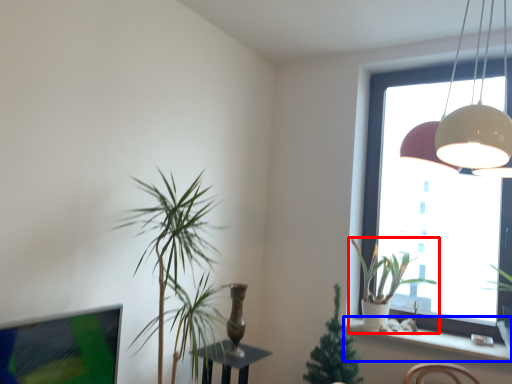
Question: Which of the following is the farthest to the observer, houseplant (highlighted by a red box) or window sill (highlighted by a blue box)?

Choices:
 (A) houseplant
 (B) window sill

Answer: (A)